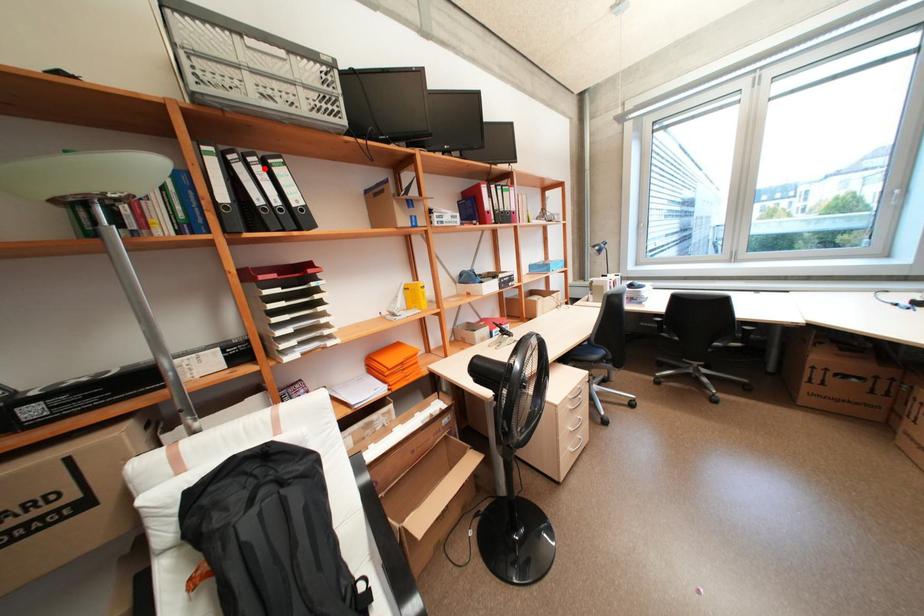
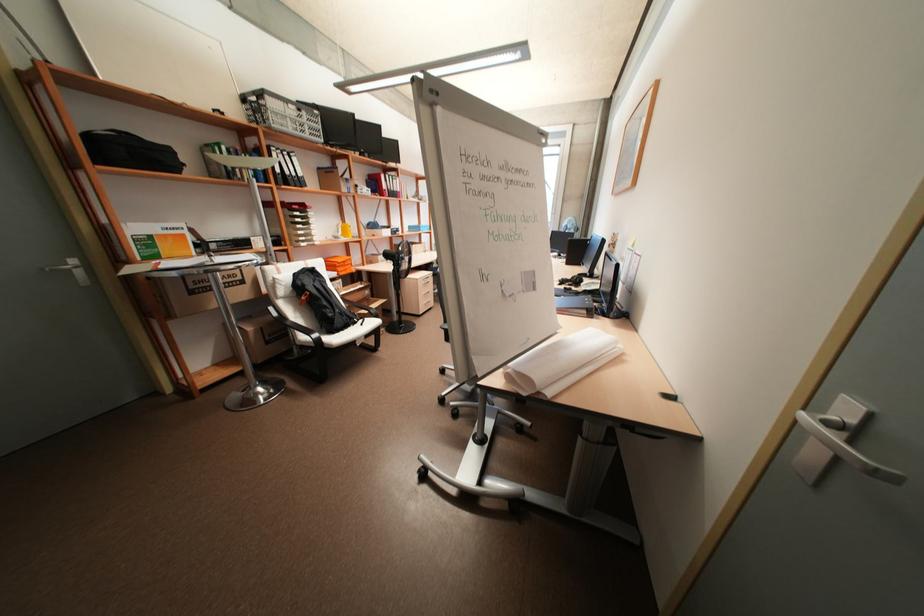
Where in the second image is the point corresponding to the highlighted location from the first image?

(293, 158)